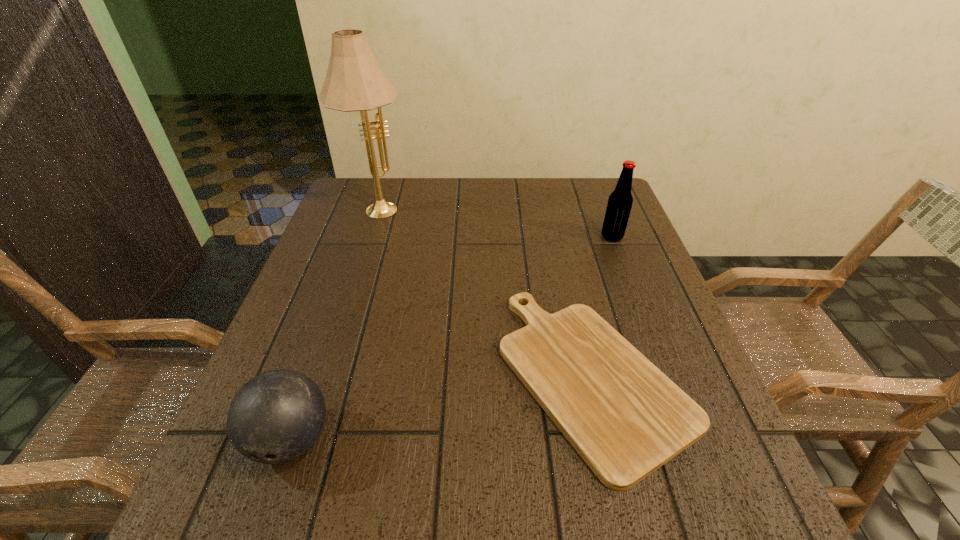
Where is `the tallest object`? the tallest object is located at coordinates (354, 81).

Where is `lampshade`? This screenshot has height=540, width=960. lampshade is located at coordinates (354, 81).

Identify the location of the second farthest object. (620, 201).

The width and height of the screenshot is (960, 540). I want to click on the third shortest object, so click(620, 201).

Image resolution: width=960 pixels, height=540 pixels. What are the coordinates of `bowling ball` in the screenshot? It's located at (275, 417).

Find the location of a particular element. the shortest object is located at coordinates (626, 418).

The width and height of the screenshot is (960, 540). Find the location of `free point located 0.130m on the right of the farthest object`. free point located 0.130m on the right of the farthest object is located at coordinates (457, 207).

Find the location of a particular element. The height and width of the screenshot is (540, 960). free spot located 0.240m on the front of the second tallest object is located at coordinates (640, 312).

What are the coordinates of `vacant space located on the grip area of the second shortest object` in the screenshot? It's located at (261, 525).

The height and width of the screenshot is (540, 960). I want to click on vacant space located on the back of the shortest object, so click(564, 253).